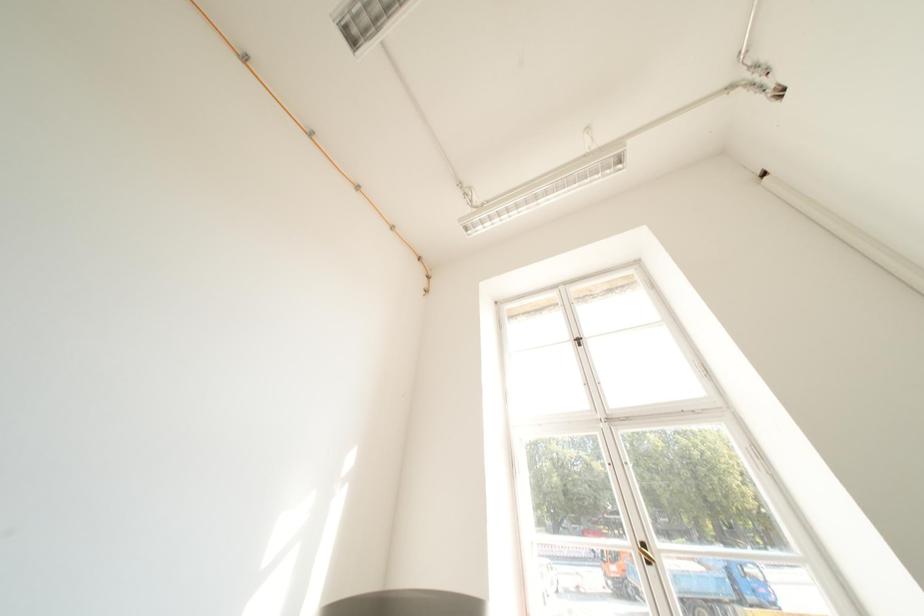
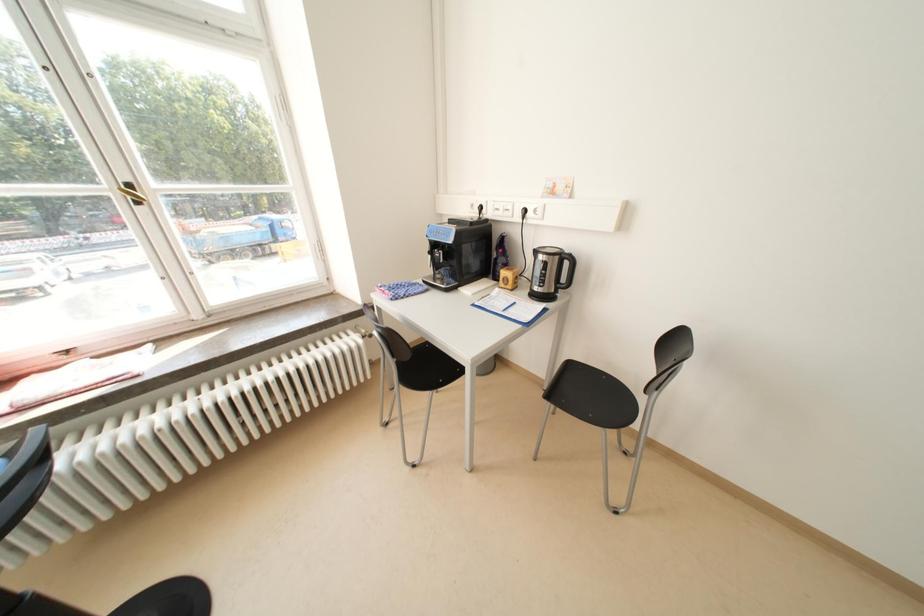
The first image is from the beginning of the video and the second image is from the end. How did the camera likely rotate when shooting the video?

The camera's rotation is toward right-down.